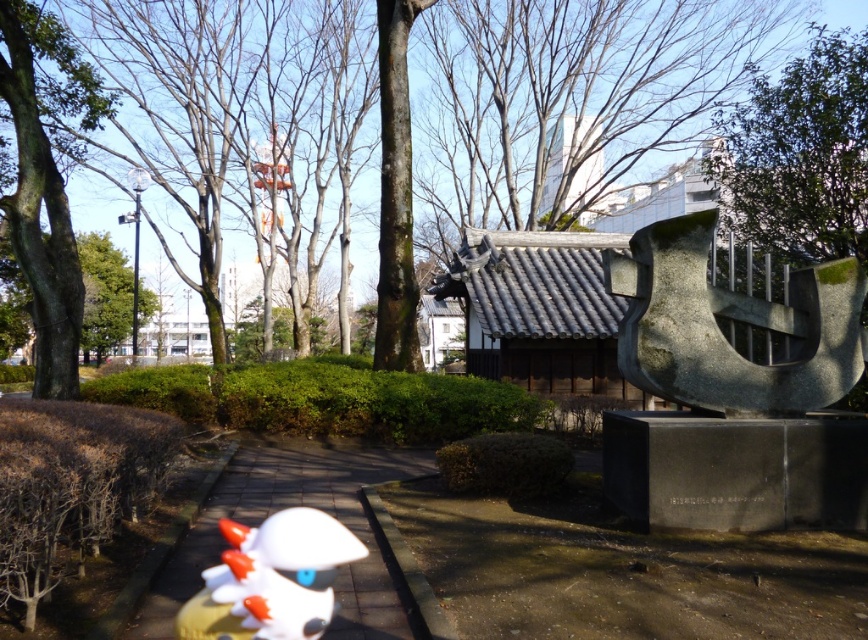
In the park scene, there is a small white chicken figure on the pathway and a large abstract stone sculpture at the right. Where is the point located at coordinates (733, 317)?

The point at coordinates (733, 317) is on the green stone sculpture at right.

From the picture: You are standing at the entrance of the park and see the brown wood tree at upper center. If you want to take a photo of it with your camera, which has a maximum zoom range of 5 meters, will you need to move closer or can you capture it from your current position?

The brown wood tree at upper center is 5.62 meters away from the camera. Since your camera can only zoom up to 5 meters, you will need to move closer to ensure the tree fills the frame properly.